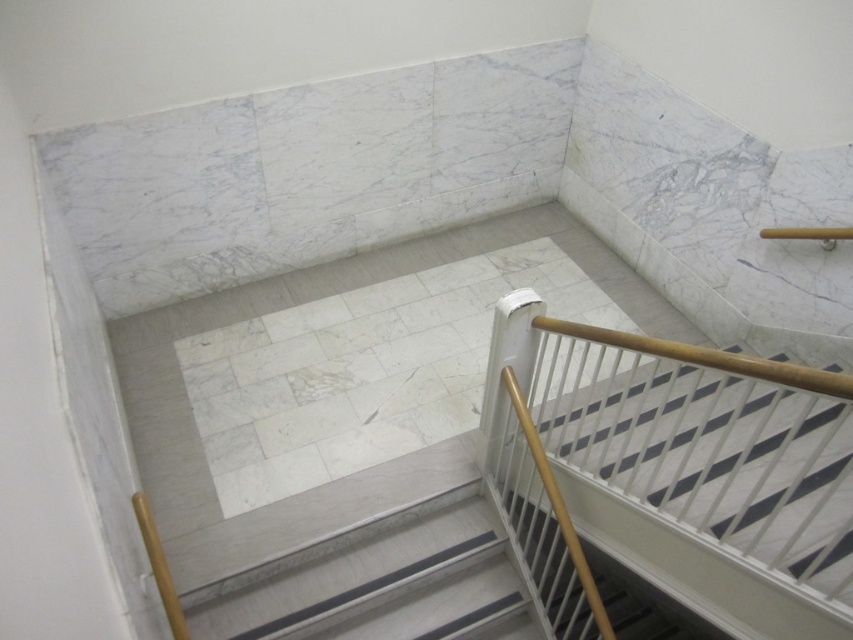
From the picture: Which is below, white plastic railing at lower right or white marble stairs at center?

white marble stairs at center

You are a GUI agent. You are given a task and a screenshot of the screen. Output one action in this format:
    pyautogui.click(x=<x>, y=<y>)
    Task: Click on the white plastic railing at lower right
    This screenshot has height=640, width=853.
    Given the screenshot: What is the action you would take?
    pyautogui.click(x=703, y=468)

Describe the element at coordinates (703, 468) in the screenshot. I see `white plastic railing at lower right` at that location.

I want to click on white plastic railing at lower right, so click(x=703, y=468).